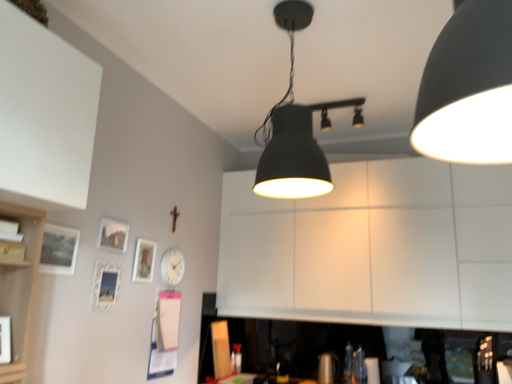
Identify the location of white matte cabinet at center. This screenshot has width=512, height=384. (373, 247).

Describe the element at coordinates (144, 260) in the screenshot. I see `matte glass picture frame at upper left, the fourth picture frame positioned from the front` at that location.

Locate an element on the screen. This screenshot has width=512, height=384. clear plastic bottle at lower center is located at coordinates (348, 364).

What do you see at coordinates (348, 364) in the screenshot? This screenshot has height=384, width=512. I see `clear plastic bottle at lower center` at bounding box center [348, 364].

Where is `matte glass picture frame at lower left, placed as the 3th picture frame when sorted from front to back`? This screenshot has height=384, width=512. matte glass picture frame at lower left, placed as the 3th picture frame when sorted from front to back is located at coordinates tap(113, 235).

From the image's perspective, is matte black picture frame at left, the 4th picture frame in the back-to-front sequence, positioned above or below white glossy picture frame at lower left, the second picture frame from the front?

Clearly, from the image's perspective, matte black picture frame at left, the 4th picture frame in the back-to-front sequence, is above white glossy picture frame at lower left, the second picture frame from the front.

Could white glossy picture frame at lower left, the second picture frame from the front, be considered to be inside matte black picture frame at left, the 4th picture frame in the back-to-front sequence?

No, white glossy picture frame at lower left, the second picture frame from the front, is not inside matte black picture frame at left, the 4th picture frame in the back-to-front sequence.

Is matte black picture frame at left, the 4th picture frame in the back-to-front sequence, not close to white glossy picture frame at lower left, the second picture frame from the front?

matte black picture frame at left, the 4th picture frame in the back-to-front sequence, is near white glossy picture frame at lower left, the second picture frame from the front, not far away.

In terms of height, does matte black picture frame at left, marked as the first picture frame in a front-to-back arrangement, look taller or shorter compared to white glossy picture frame at lower left, acting as the third picture frame starting from the back?

In the image, matte black picture frame at left, marked as the first picture frame in a front-to-back arrangement, appears to be shorter than white glossy picture frame at lower left, acting as the third picture frame starting from the back.

Would you consider matte glass picture frame at upper left, the 1th picture frame in the back-to-front sequence, to be distant from matte black picture frame at left, marked as the first picture frame in a front-to-back arrangement?

Actually, matte glass picture frame at upper left, the 1th picture frame in the back-to-front sequence, and matte black picture frame at left, marked as the first picture frame in a front-to-back arrangement, are a little close together.

Considering the positions of objects matte glass picture frame at upper left, the 1th picture frame in the back-to-front sequence, and matte black picture frame at left, marked as the first picture frame in a front-to-back arrangement, in the image provided, who is more to the left, matte glass picture frame at upper left, the 1th picture frame in the back-to-front sequence, or matte black picture frame at left, marked as the first picture frame in a front-to-back arrangement,?

matte black picture frame at left, marked as the first picture frame in a front-to-back arrangement.

What's the angular difference between matte glass picture frame at upper left, the fourth picture frame positioned from the front, and matte black picture frame at left, the 4th picture frame in the back-to-front sequence,'s facing directions?

There is a 0.827-degree angle between the facing directions of matte glass picture frame at upper left, the fourth picture frame positioned from the front, and matte black picture frame at left, the 4th picture frame in the back-to-front sequence.

From the image's perspective, between white glossy picture frame at lower left, the second picture frame from the front, and clear plastic bottle at lower center, who is located below?

clear plastic bottle at lower center, from the image's perspective.

Is white glossy picture frame at lower left, the second picture frame from the front, located outside clear plastic bottle at lower center?

That's correct, white glossy picture frame at lower left, the second picture frame from the front, is outside of clear plastic bottle at lower center.

Is point (103, 290) closer to camera compared to point (344, 360)?

Yes, it is in front of point (344, 360).

Consider the image. Which is closer, (103, 279) or (289, 90)?

Point (103, 279) appears to be closer to the viewer than point (289, 90).

From the image's perspective, is white glossy picture frame at lower left, acting as the third picture frame starting from the back, over matte black lampshade at center, the second lamp positioned from the back?

Incorrect, from the image's perspective, white glossy picture frame at lower left, acting as the third picture frame starting from the back, is lower than matte black lampshade at center, the second lamp positioned from the back.

Could you tell me if white glossy picture frame at lower left, acting as the third picture frame starting from the back, is turned towards matte black lampshade at center, positioned as the first lamp in front-to-back order?

No.

Does white glossy picture frame at lower left, acting as the third picture frame starting from the back, have a lesser height compared to matte black lampshade at center, the 1th lamp viewed from the left?

Indeed, white glossy picture frame at lower left, acting as the third picture frame starting from the back, has a lesser height compared to matte black lampshade at center, the 1th lamp viewed from the left.

Does point (74, 251) appear closer or farther from the camera than point (146, 267)?

Point (74, 251) appears to be closer to the viewer than point (146, 267).

Between matte black picture frame at left, marked as the first picture frame in a front-to-back arrangement, and matte glass picture frame at upper left, the fourth picture frame positioned from the front, which one has smaller width?

With smaller width is matte glass picture frame at upper left, the fourth picture frame positioned from the front.

From the image's perspective, which one is positioned lower, matte black picture frame at left, marked as the first picture frame in a front-to-back arrangement, or matte glass picture frame at upper left, the fourth picture frame positioned from the front?

matte glass picture frame at upper left, the fourth picture frame positioned from the front, appears lower in the image.

You are a GUI agent. You are given a task and a screenshot of the screen. Output one action in this format:
    pyautogui.click(x=<x>, y=<y>)
    Task: Click on the picture frame that is the 3rd object located behind the matte black picture frame at left, the 4th picture frame in the back-to-front sequence
    
    Given the screenshot: What is the action you would take?
    pyautogui.click(x=144, y=260)

Is matte black track lights at upper center, placed as the 2th lamp when sorted from front to back, at the back of matte glass picture frame at lower left, the 2th picture frame viewed from the back?

No, matte black track lights at upper center, placed as the 2th lamp when sorted from front to back, is not at the back of matte glass picture frame at lower left, the 2th picture frame viewed from the back.

Would you say matte glass picture frame at lower left, placed as the 3th picture frame when sorted from front to back, is a long distance from matte black track lights at upper center, placed as the 2th lamp when sorted from front to back?

Yes.

Considering the sizes of objects matte glass picture frame at lower left, placed as the 3th picture frame when sorted from front to back, and matte black track lights at upper center, placed as the 2th lamp when sorted from front to back, in the image provided, who is smaller, matte glass picture frame at lower left, placed as the 3th picture frame when sorted from front to back, or matte black track lights at upper center, placed as the 2th lamp when sorted from front to back,?

matte glass picture frame at lower left, placed as the 3th picture frame when sorted from front to back.

How different are the orientations of matte glass picture frame at lower left, the 2th picture frame viewed from the back, and matte black track lights at upper center, which is the second lamp from left to right, in degrees?

The angle between the facing direction of matte glass picture frame at lower left, the 2th picture frame viewed from the back, and the facing direction of matte black track lights at upper center, which is the second lamp from left to right, is 0.766 degrees.

Is white matte cabinet at center positioned beyond the bounds of white matte clock at lower left?

Yes, white matte cabinet at center is not within white matte clock at lower left.

Consider the image. Is the surface of white matte cabinet at center in direct contact with white matte clock at lower left?

No, white matte cabinet at center is not beside white matte clock at lower left.

Which object is more forward, white matte cabinet at center or white matte clock at lower left?

white matte cabinet at center is in front.

Locate an element on the screen. The height and width of the screenshot is (384, 512). the 2nd picture frame above when counting from the white glossy picture frame at lower left, acting as the third picture frame starting from the back (from the image's perspective) is located at coordinates (59, 250).

Where is `the 1st picture frame located above the matte glass picture frame at upper left, the 1th picture frame in the back-to-front sequence (from a real-world perspective)`? The image size is (512, 384). the 1st picture frame located above the matte glass picture frame at upper left, the 1th picture frame in the back-to-front sequence (from a real-world perspective) is located at coordinates (59, 250).

Based on their spatial positions, is clear plastic bottle at lower center or matte black lampshade at center, positioned as the first lamp in front-to-back order, closer to matte black picture frame at left, marked as the first picture frame in a front-to-back arrangement?

Based on the image, matte black lampshade at center, positioned as the first lamp in front-to-back order, appears to be nearer to matte black picture frame at left, marked as the first picture frame in a front-to-back arrangement.

Which object lies further to the anchor point matte black track lights at upper center, the first lamp in the back-to-front sequence, matte glass picture frame at lower left, placed as the 3th picture frame when sorted from front to back, or matte black lampshade at center, the second lamp positioned from the back?

Based on the image, matte glass picture frame at lower left, placed as the 3th picture frame when sorted from front to back, appears to be further to matte black track lights at upper center, the first lamp in the back-to-front sequence.

Which object lies nearer to the anchor point matte black track lights at upper center, placed as the 2th lamp when sorted from front to back, white matte cabinet at center or matte glass picture frame at upper left, the fourth picture frame positioned from the front?

Among the two, white matte cabinet at center is located nearer to matte black track lights at upper center, placed as the 2th lamp when sorted from front to back.

Looking at the image, which one is located closer to matte glass picture frame at lower left, the 2th picture frame viewed from the back, matte black lampshade at center, the 1th lamp viewed from the left, or white glossy picture frame at lower left, acting as the third picture frame starting from the back?

The object closer to matte glass picture frame at lower left, the 2th picture frame viewed from the back, is white glossy picture frame at lower left, acting as the third picture frame starting from the back.

From the image, which object appears to be farther from matte black picture frame at left, marked as the first picture frame in a front-to-back arrangement, matte black lampshade at center, acting as the 2th lamp starting from the right, or matte glass picture frame at upper left, the 1th picture frame in the back-to-front sequence?

matte black lampshade at center, acting as the 2th lamp starting from the right.

From the image, which object appears to be nearer to matte glass picture frame at upper left, the fourth picture frame positioned from the front, white matte clock at lower left or white glossy picture frame at lower left, the second picture frame from the front?

white matte clock at lower left is positioned closer to the anchor matte glass picture frame at upper left, the fourth picture frame positioned from the front.

Based on their spatial positions, is matte glass picture frame at upper left, the 1th picture frame in the back-to-front sequence, or white matte cabinet at center further from matte glass picture frame at lower left, placed as the 3th picture frame when sorted from front to back?

white matte cabinet at center is further to matte glass picture frame at lower left, placed as the 3th picture frame when sorted from front to back.

Looking at the image, which one is located further to white glossy picture frame at lower left, acting as the third picture frame starting from the back, matte black lampshade at center, the second lamp positioned from the back, or matte black track lights at upper center, the first lamp in the back-to-front sequence?

Among the two, matte black track lights at upper center, the first lamp in the back-to-front sequence, is located further to white glossy picture frame at lower left, acting as the third picture frame starting from the back.

Find the location of a particular element. The image size is (512, 384). picture frame located between matte glass picture frame at lower left, placed as the 3th picture frame when sorted from front to back, and white matte clock at lower left in the depth direction is located at coordinates (144, 260).

At what (x,y) coordinates should I click in order to perform the action: click on lamp located between matte black picture frame at left, the 4th picture frame in the back-to-front sequence, and matte black track lights at upper center, which is the second lamp from left to right, in the left-right direction. Please return your answer as a coordinate pair (x, y). This screenshot has width=512, height=384. Looking at the image, I should click on (295, 129).

Image resolution: width=512 pixels, height=384 pixels. What are the coordinates of `clock between white glossy picture frame at lower left, the second picture frame from the front, and matte black track lights at upper center, the first lamp in the back-to-front sequence, from left to right` in the screenshot? It's located at (172, 266).

You are a GUI agent. You are given a task and a screenshot of the screen. Output one action in this format:
    pyautogui.click(x=<x>, y=<y>)
    Task: Click on the clock located between matte glass picture frame at upper left, the 1th picture frame in the back-to-front sequence, and matte black track lights at upper center, the first lamp in the back-to-front sequence, in the left-right direction
    
    Given the screenshot: What is the action you would take?
    pyautogui.click(x=172, y=266)